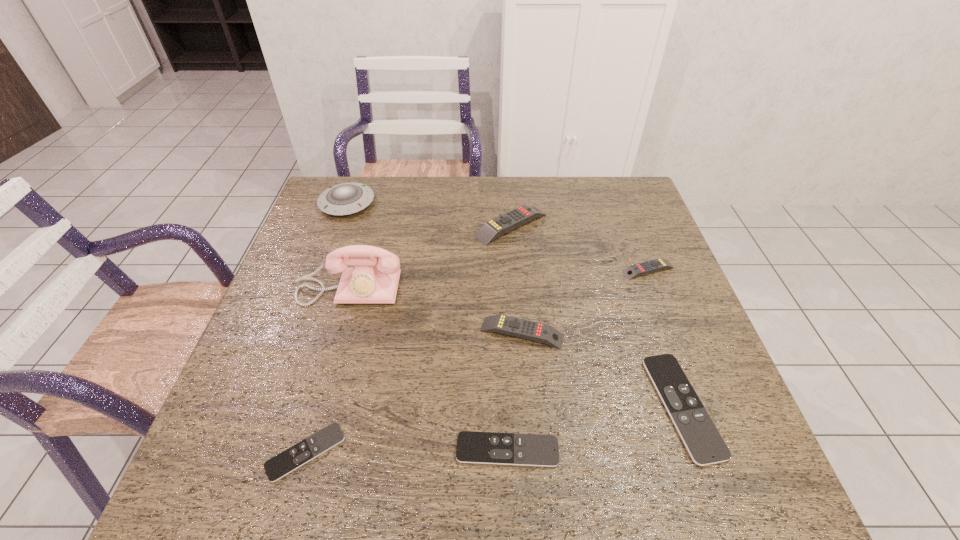
The height and width of the screenshot is (540, 960). Identify the location of vacant space located 0.330m on the back of the biggest black remote control. (630, 258).

Locate an element on the screen. The image size is (960, 540). free point located 0.290m on the right of the second shortest object is located at coordinates (710, 450).

The height and width of the screenshot is (540, 960). Identify the location of free space located 0.260m on the right of the leftmost remote control. (479, 452).

This screenshot has width=960, height=540. I want to click on saucer present at the far edge, so click(346, 198).

The width and height of the screenshot is (960, 540). Identify the location of remote control at the far edge. (500, 225).

Identify the location of telephone at the left edge. This screenshot has height=540, width=960. (370, 280).

The width and height of the screenshot is (960, 540). What are the coordinates of `saucer that is at the left edge` in the screenshot? It's located at (346, 198).

Locate an element on the screen. This screenshot has height=540, width=960. remote control that is at the left edge is located at coordinates (306, 450).

This screenshot has width=960, height=540. Identify the location of object located at the far left corner. (346, 198).

At what (x,y) coordinates should I click in order to perform the action: click on object that is at the near left corner. Please return your answer as a coordinate pair (x, y). Looking at the image, I should click on (306, 450).